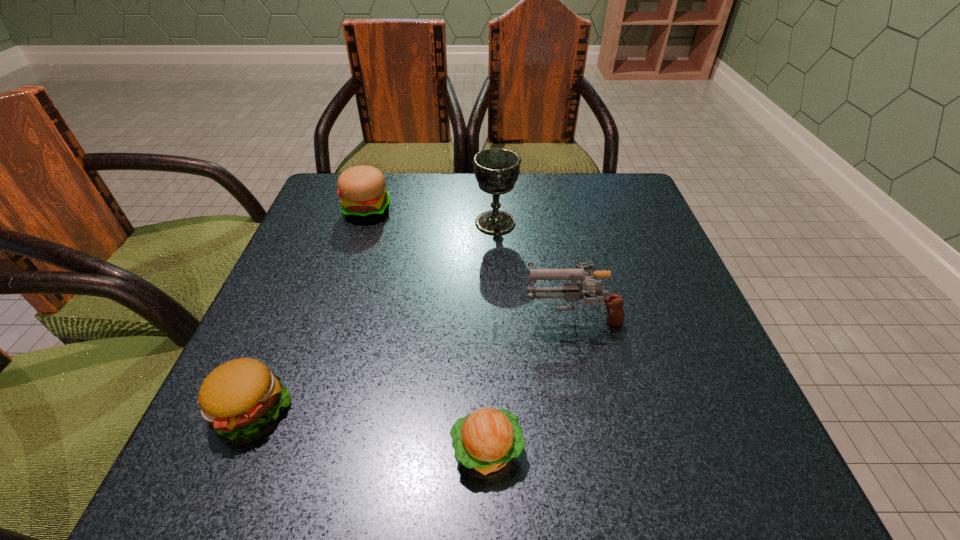
Image resolution: width=960 pixels, height=540 pixels. I want to click on free region located 0.220m on the right of the third shortest object, so click(x=483, y=210).

Identify the location of vacant point located 0.090m on the left of the rightmost hamburger. (387, 450).

You are a GUI agent. You are given a task and a screenshot of the screen. Output one action in this format:
    pyautogui.click(x=<x>, y=<y>)
    Task: Click on the chalice present at the far edge
    The width and height of the screenshot is (960, 540).
    Given the screenshot: What is the action you would take?
    pyautogui.click(x=496, y=170)

The height and width of the screenshot is (540, 960). What are the coordinates of `hamburger that is at the far edge` in the screenshot? It's located at (362, 189).

At what (x,y) coordinates should I click in order to perform the action: click on object that is at the right edge. Please return your answer as a coordinate pair (x, y). Looking at the image, I should click on (571, 293).

You are a GUI agent. You are given a task and a screenshot of the screen. Output one action in this format:
    pyautogui.click(x=<x>, y=<y>)
    Task: Click on the object situated at the far left corner
    This screenshot has height=540, width=960.
    Given the screenshot: What is the action you would take?
    pyautogui.click(x=362, y=189)

Where is `object that is at the near left corner`? object that is at the near left corner is located at coordinates (237, 398).

Locate an element on the screen. The height and width of the screenshot is (540, 960). free point at the far edge is located at coordinates (486, 197).

Where is `vacant space at the near edge`? vacant space at the near edge is located at coordinates (332, 449).

The image size is (960, 540). I want to click on vacant region at the left edge of the desktop, so click(x=264, y=320).